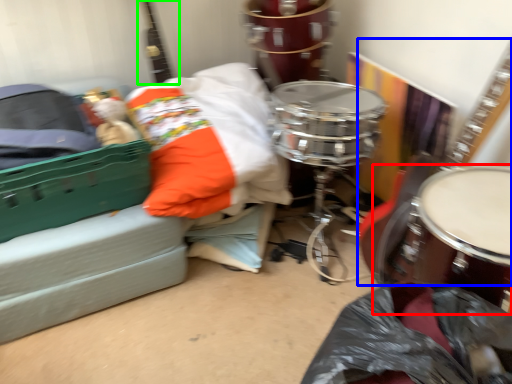
Question: Which object is the farthest from drum (highlighted by a red box)? Choose among these: guitar (highlighted by a blue box) or guitar (highlighted by a green box).

Choices:
 (A) guitar
 (B) guitar

Answer: (B)